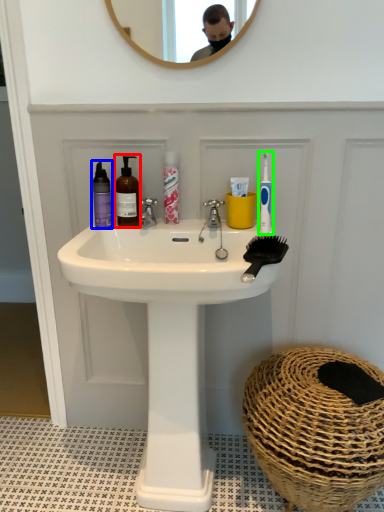
Question: Which object is the closest to the mouthwash (highlighted by a red box)? Choose among these: mouthwash (highlighted by a blue box) or toothbrush (highlighted by a green box).

Choices:
 (A) mouthwash
 (B) toothbrush

Answer: (A)